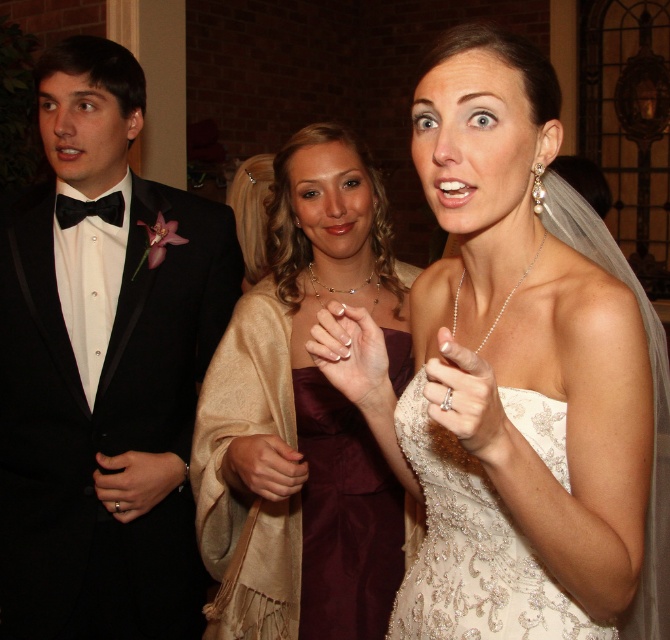
Question: Does satin gold dress at center appear over ivory lace dress at center?

Choices:
 (A) yes
 (B) no

Answer: (A)

Question: Based on their relative distances, which object is farther from the black satin tuxedo at left?

Choices:
 (A) ivory lace dress at center
 (B) satin gold dress at center

Answer: (A)

Question: Which object is the closest to the satin gold dress at center?

Choices:
 (A) ivory lace dress at center
 (B) black satin tuxedo at left

Answer: (B)

Question: Does satin gold dress at center have a greater width compared to ivory lace dress at center?

Choices:
 (A) yes
 (B) no

Answer: (A)

Question: Among these objects, which one is nearest to the camera?

Choices:
 (A) satin gold dress at center
 (B) ivory lace dress at center

Answer: (B)

Question: Observing the image, what is the correct spatial positioning of black satin tuxedo at left in reference to satin gold dress at center?

Choices:
 (A) left
 (B) right

Answer: (A)